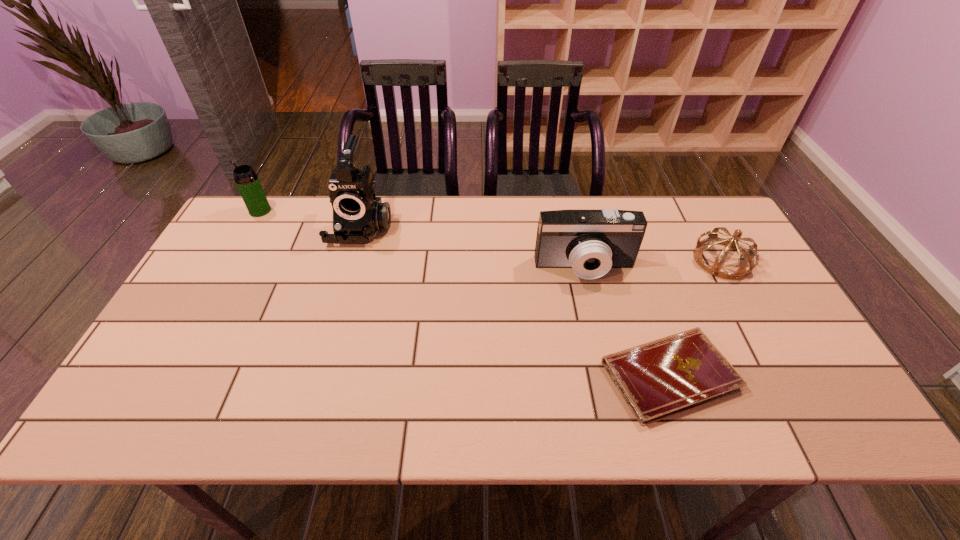
At what (x,y) coordinates should I click in order to perform the action: click on object that is at the far right corner. Please return your answer as a coordinate pair (x, y). Looking at the image, I should click on (745, 255).

Where is `free space at the far edge`? The width and height of the screenshot is (960, 540). free space at the far edge is located at coordinates (313, 238).

In the image, there is a desktop. Where is `vacant region at the near edge`? The image size is (960, 540). vacant region at the near edge is located at coordinates (307, 411).

Find the location of a particular element. vacant space at the left edge of the desktop is located at coordinates (219, 338).

I want to click on vacant space at the right edge of the desktop, so click(800, 369).

Image resolution: width=960 pixels, height=540 pixels. I want to click on vacant space at the far right corner of the desktop, so click(684, 222).

Find the location of a particular element. Image resolution: width=960 pixels, height=540 pixels. unoccupied area between the nearer camcorder and the nearest object is located at coordinates pos(627,322).

Locate an element on the screen. The image size is (960, 540). vacant region between the thermos bottle and the shortest object is located at coordinates (465, 293).

Find the location of a particular element. Image resolution: width=960 pixels, height=540 pixels. free space that is in between the rightmost object and the nearer camcorder is located at coordinates (654, 264).

Identify the location of free spot between the leftmost object and the nearer camcorder. The image size is (960, 540). (422, 239).